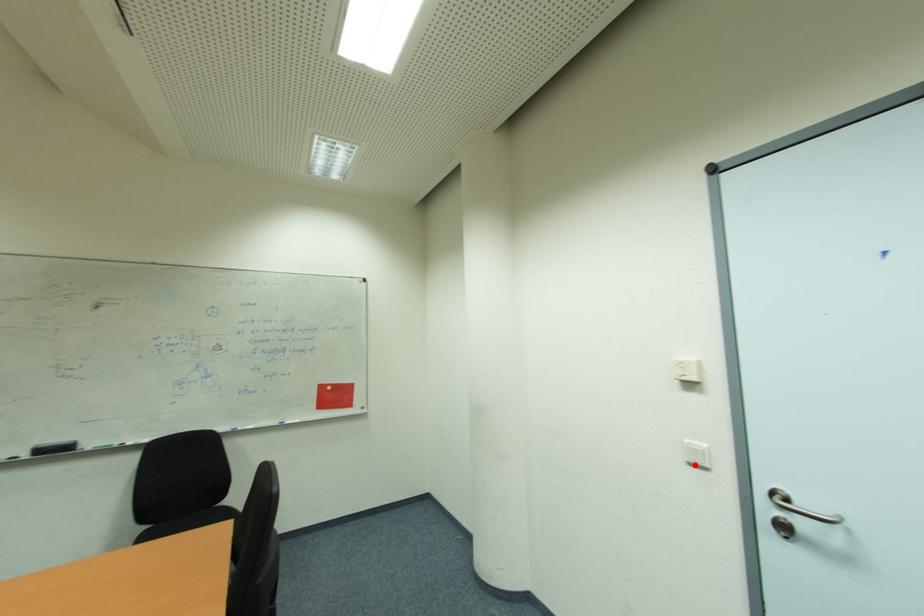
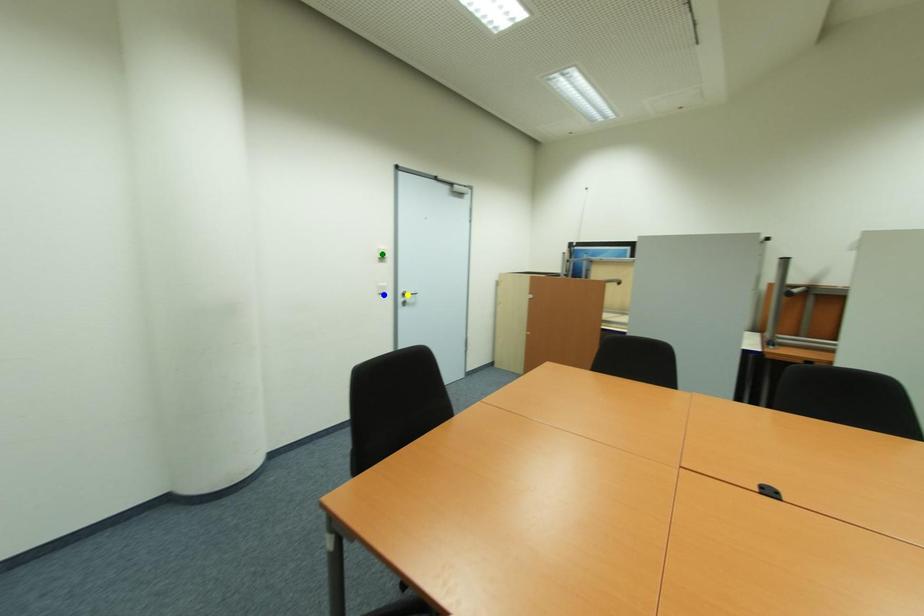
Question: I am providing you with two images of the same scene from different viewpoints. A red point is marked on the first image. You are given multiple points on the second image. Which point in image 2 is actually the same real-world point as the red point in image 1?

Choices:
 (A) yellow point
 (B) green point
 (C) blue point

Answer: (C)